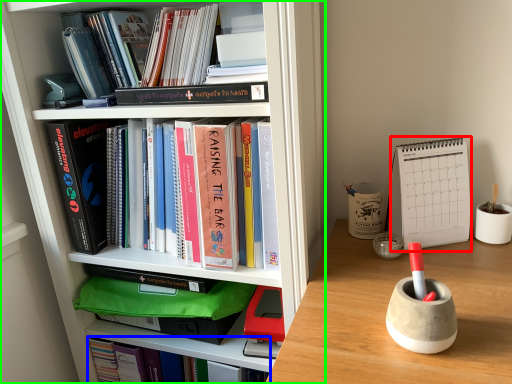
Question: Which object is the farthest from paperback book (highlighted by a red box)? Choose among these: book (highlighted by a blue box) or bookcase (highlighted by a green box).

Choices:
 (A) book
 (B) bookcase

Answer: (A)